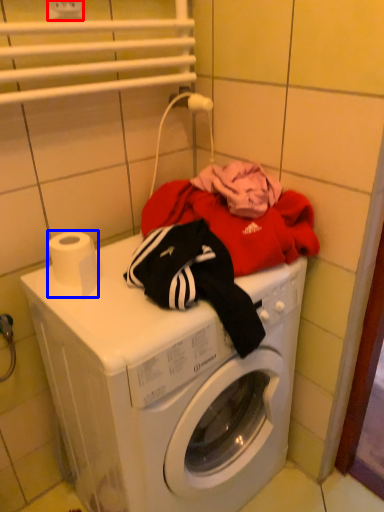
Question: Which point is further to the camera, electric outlet (highlighted by a red box) or toilet paper (highlighted by a blue box)?

Choices:
 (A) electric outlet
 (B) toilet paper

Answer: (A)